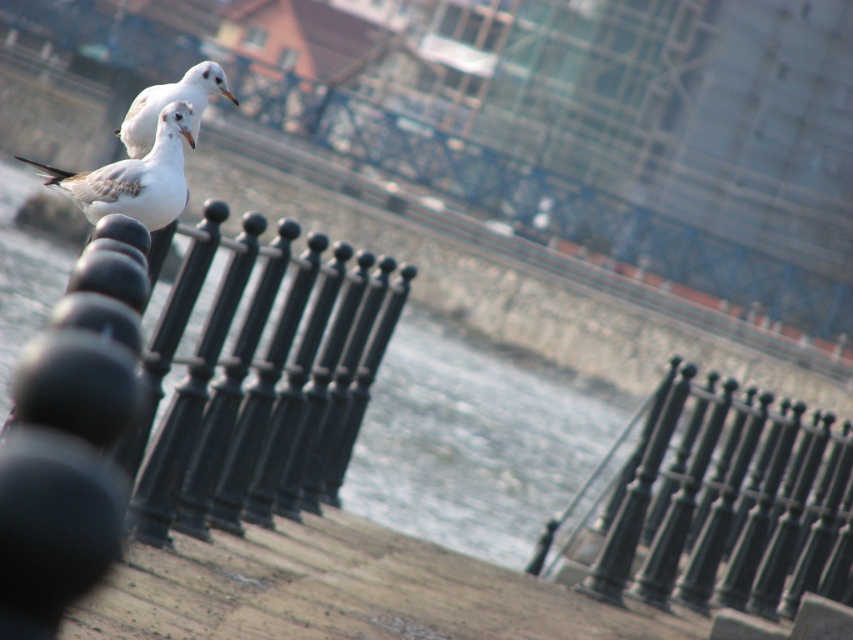
Question: Can you confirm if white feathered seagull at center is positioned below white matte seagull at upper center?

Choices:
 (A) yes
 (B) no

Answer: (B)

Question: Which object is the farthest from the white feathered seagull at center?

Choices:
 (A) white matte seagull at upper center
 (B) black metal fence at upper left

Answer: (A)

Question: Which of the following is the farthest from the observer?

Choices:
 (A) (392, 369)
 (B) (236, 99)

Answer: (A)

Question: From the image, what is the correct spatial relationship of white feathered seagull at center in relation to white matte seagull at upper center?

Choices:
 (A) above
 (B) below

Answer: (A)

Question: Is black metal fence at upper left bigger than white feathered seagull at center?

Choices:
 (A) yes
 (B) no

Answer: (A)

Question: Which object is the farthest from the black metal fence at upper left?

Choices:
 (A) white matte seagull at upper center
 (B) white feathered seagull at center

Answer: (A)